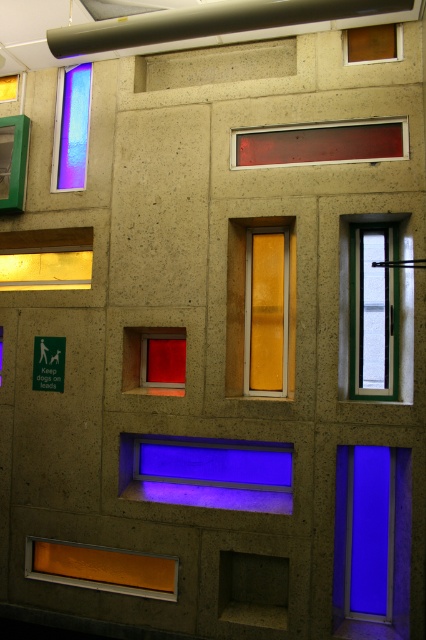
Does blue glass window at right have a greater width compared to blue glass window at center?

No.

I want to click on blue glass window at right, so click(371, 541).

The height and width of the screenshot is (640, 426). What do you see at coordinates (371, 541) in the screenshot?
I see `blue glass window at right` at bounding box center [371, 541].

Identify the location of blue glass window at right. The height and width of the screenshot is (640, 426). (371, 541).

Who is lower down, matte green glass window at left or matte brown window at upper right?

matte green glass window at left is below.

Does point (19, 138) lie in front of point (345, 60)?

No, it is behind (345, 60).

Locate an element on the screen. matte green glass window at left is located at coordinates (13, 161).

Who is positioned more to the left, matte gold window at lower left or transparent glass at upper left?

From the viewer's perspective, matte gold window at lower left appears more on the left side.

Is matte gold window at lower left smaller than transparent glass at upper left?

Actually, matte gold window at lower left might be larger than transparent glass at upper left.

In order to click on matte gold window at lower left in this screenshot , I will do `click(46, 259)`.

Image resolution: width=426 pixels, height=640 pixels. Find the location of `matte gold window at lower left`. matte gold window at lower left is located at coordinates (46, 259).